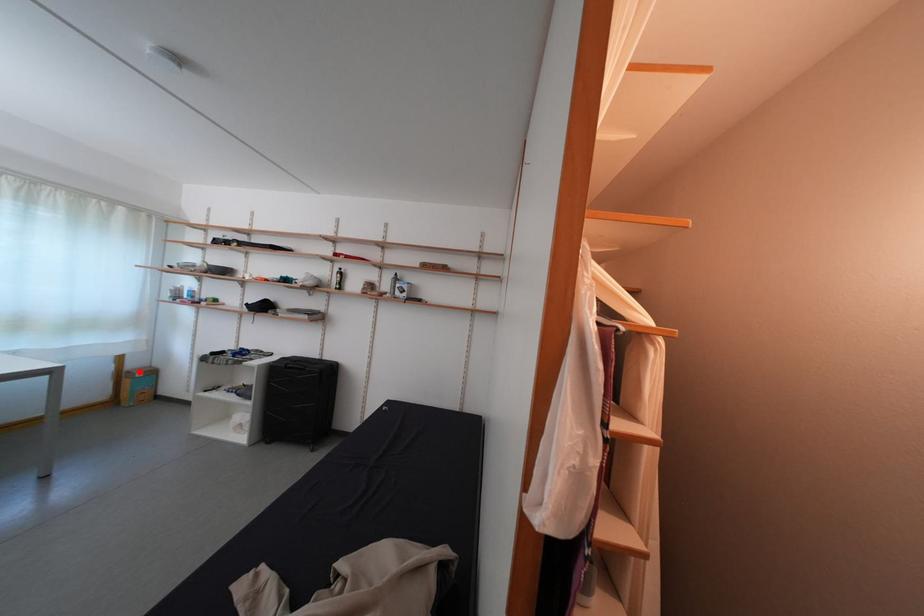
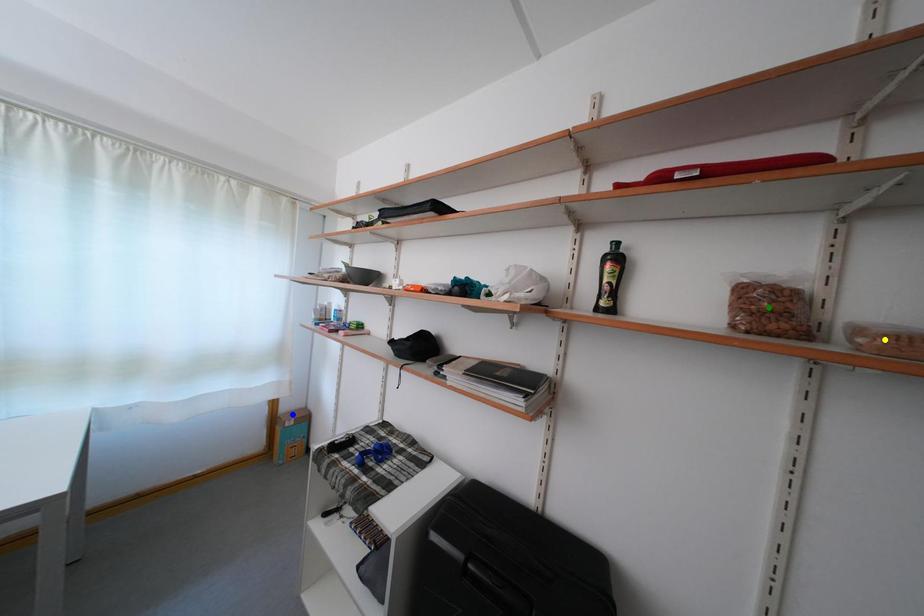
Question: I am providing you with two images of the same scene from different viewpoints. A red point is marked on the first image. You are given multiple points on the second image. Which point in image 2 is actually the same real-world point as the red point in image 1?

Choices:
 (A) yellow point
 (B) blue point
 (C) green point

Answer: (B)